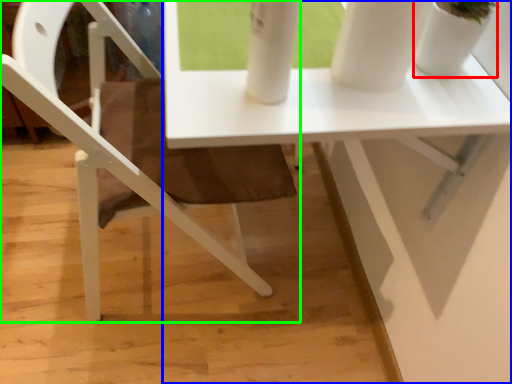
Question: Which is farther away from glass vase (highlighted by a red box)? table (highlighted by a blue box) or chair (highlighted by a green box)?

Choices:
 (A) table
 (B) chair

Answer: (B)